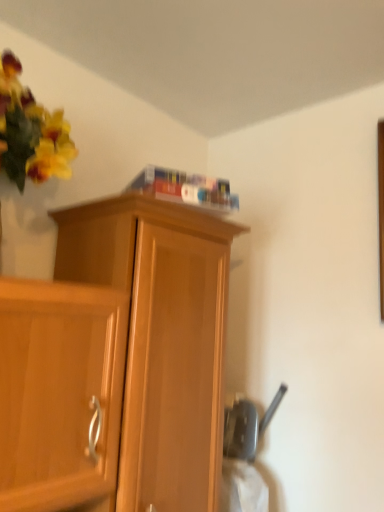
The height and width of the screenshot is (512, 384). Describe the element at coordinates (30, 131) in the screenshot. I see `matte yellow flower at upper left` at that location.

This screenshot has width=384, height=512. Find the location of `matte yellow flower at upper left`. matte yellow flower at upper left is located at coordinates (30, 131).

Locate an element on the screen. matte yellow flower at upper left is located at coordinates (30, 131).